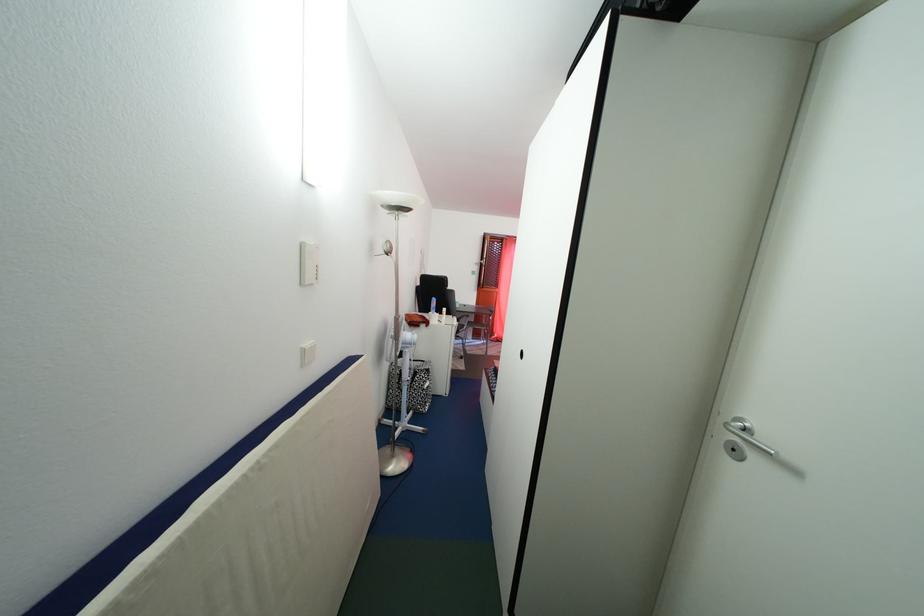
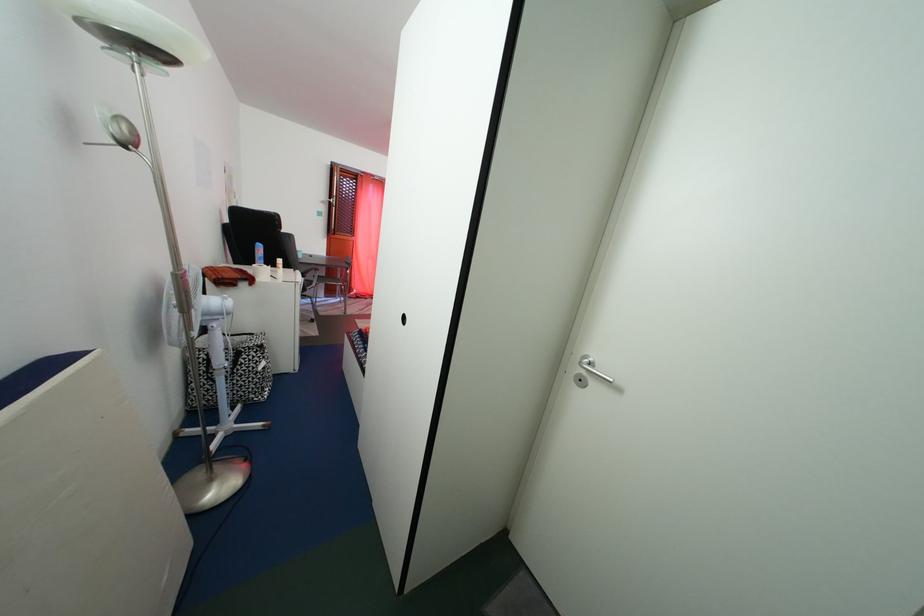
Question: How did the camera likely rotate?

Choices:
 (A) Left
 (B) Right
 (C) Up
 (D) Down

Answer: (B)